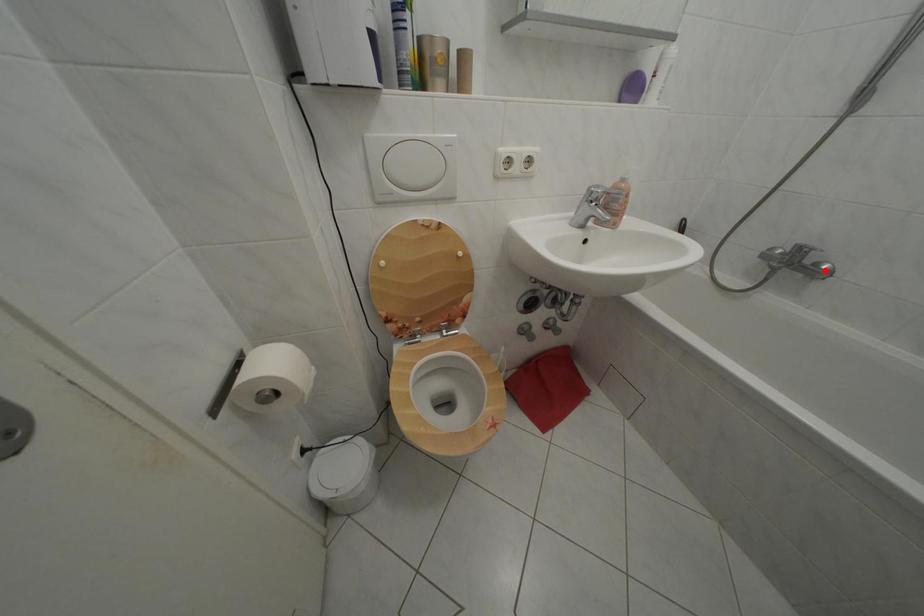
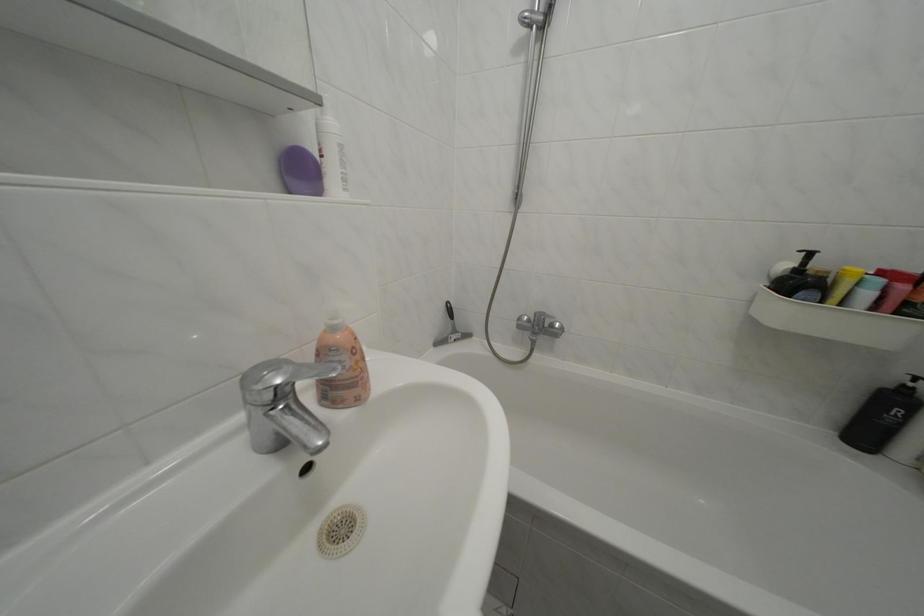
The point at the highlighted location is marked in the first image. Where is the corresponding point in the second image?

(562, 331)